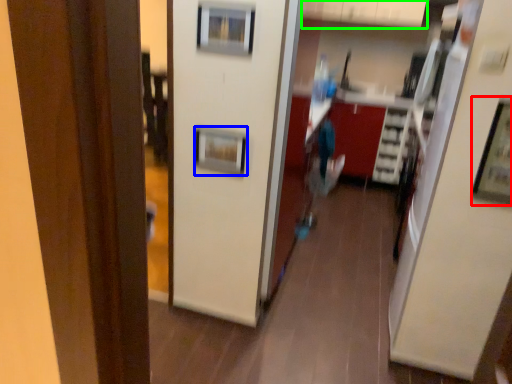
Question: Which object is positioned closest to picture frame (highlighted by a red box)? Select from picture frame (highlighted by a blue box) and cabinetry (highlighted by a green box).

Choices:
 (A) picture frame
 (B) cabinetry

Answer: (A)